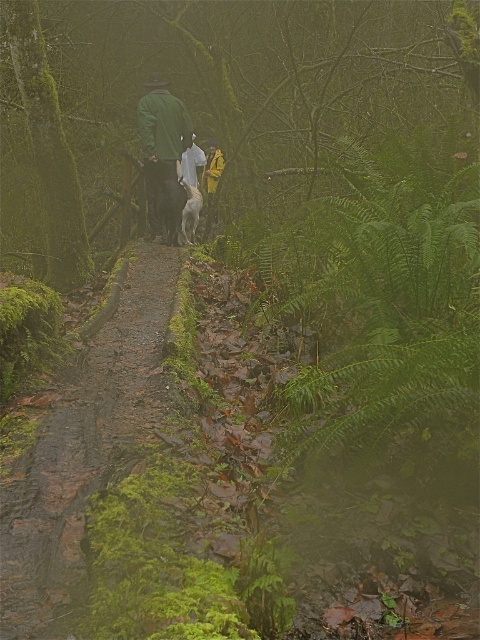
Question: Which of the following is the farthest from the observer?

Choices:
 (A) green matte jacket at center
 (B) mossy dirt path at center
 (C) white fur dog at center
 (D) green wool jacket at center

Answer: (D)

Question: Which of the following is the closest to the observer?

Choices:
 (A) mossy dirt path at center
 (B) green leafy fern at center right

Answer: (A)

Question: Does mossy dirt path at center appear on the right side of green wool jacket at center?

Choices:
 (A) yes
 (B) no

Answer: (B)

Question: Which point is closer to the camera taking this photo?

Choices:
 (A) pos(410,275)
 (B) pos(152,104)

Answer: (A)

Question: Is green leafy fern at center right positioned before white fur dog at center?

Choices:
 (A) yes
 (B) no

Answer: (A)

Question: Does mossy dirt path at center appear under yellow waterproof jacket at center?

Choices:
 (A) no
 (B) yes

Answer: (B)